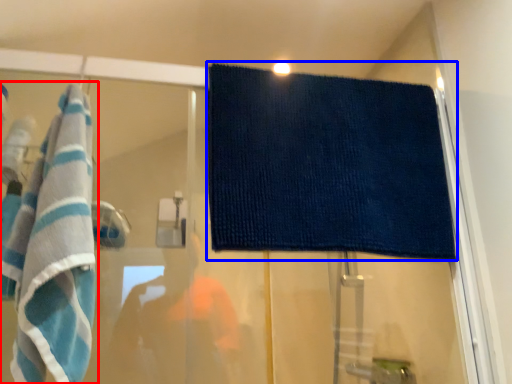
Question: Which object is further to the camera taking this photo, towel (highlighted by a red box) or towel (highlighted by a blue box)?

Choices:
 (A) towel
 (B) towel

Answer: (B)